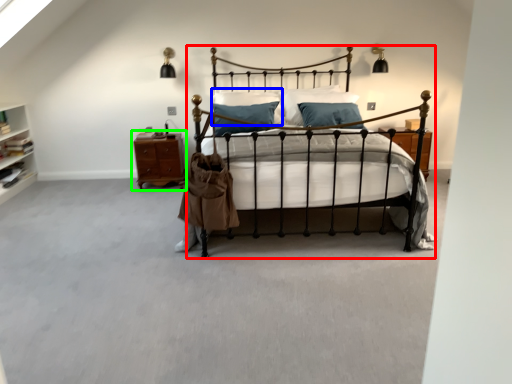
Question: Which is nearer to the bed (highlighted by a red box)? pillow (highlighted by a blue box) or nightstand (highlighted by a green box).

Choices:
 (A) pillow
 (B) nightstand

Answer: (B)